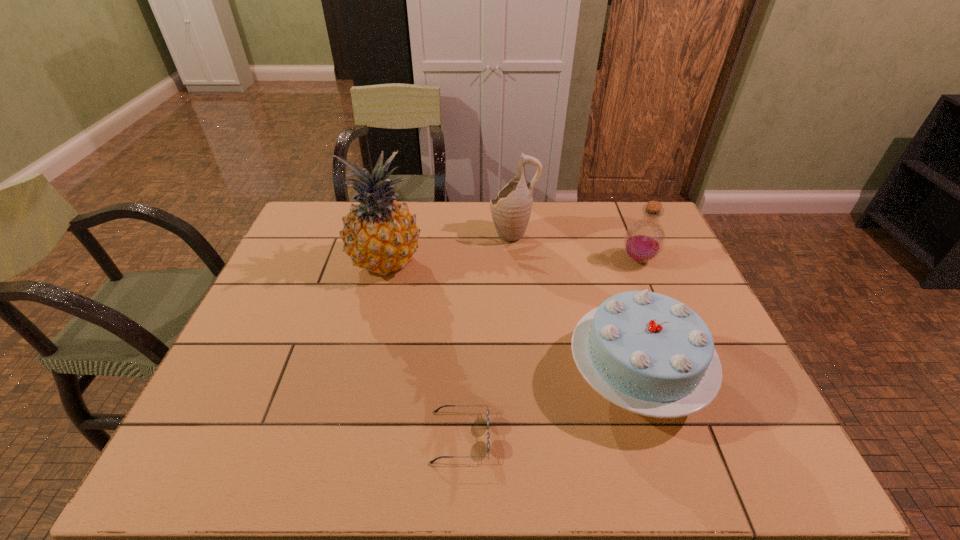
Locate an element on the screen. This screenshot has width=960, height=540. free location located 0.220m at the spout of the third object from left to right is located at coordinates point(423,234).

Locate an element on the screen. vacant space located at the spout of the third object from left to right is located at coordinates (438, 234).

Where is `vacant area situated on the back of the bottle`? The width and height of the screenshot is (960, 540). vacant area situated on the back of the bottle is located at coordinates (624, 224).

Where is `vacant space located on the left of the birthday cake`? vacant space located on the left of the birthday cake is located at coordinates (488, 375).

Image resolution: width=960 pixels, height=540 pixels. In order to click on vacant space located 0.230m on the front-facing side of the sunglasses in this screenshot , I will do `click(598, 436)`.

I want to click on pineapple that is positioned at the far edge, so click(380, 235).

You are a GUI agent. You are given a task and a screenshot of the screen. Output one action in this format:
    pyautogui.click(x=<x>, y=<y>)
    Task: Click on the pitcher situated at the far edge
    The image size is (960, 540).
    Given the screenshot: What is the action you would take?
    pyautogui.click(x=511, y=209)

At what (x,y) coordinates should I click in order to perform the action: click on birthday cake present at the near edge. Please return your answer as a coordinate pair (x, y). This screenshot has width=960, height=540. Looking at the image, I should click on (648, 353).

Find the location of a particular element. The image size is (960, 540). sunglasses located in the near edge section of the desktop is located at coordinates (488, 434).

The image size is (960, 540). What are the coordinates of `bottle that is at the right edge` in the screenshot? It's located at (644, 240).